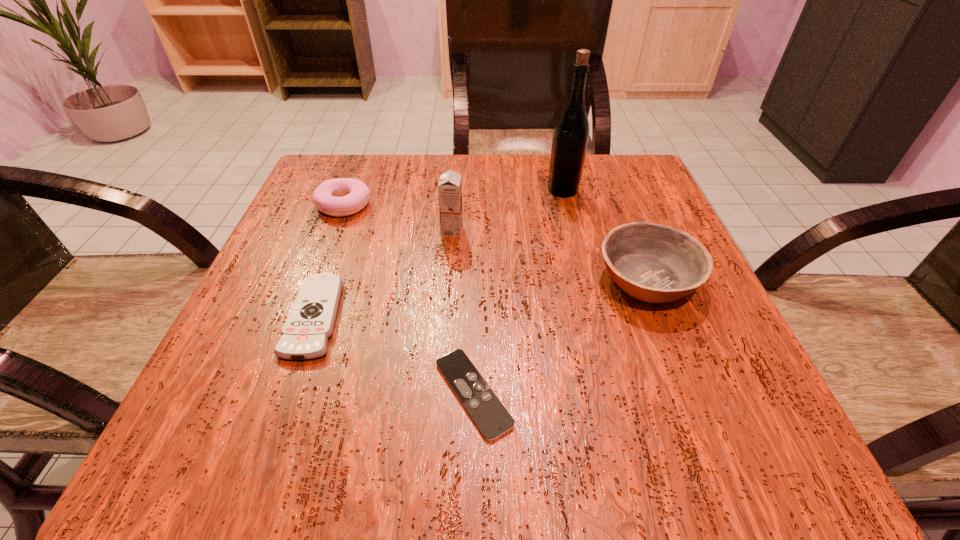
Image resolution: width=960 pixels, height=540 pixels. Find the location of `the tallest object`. the tallest object is located at coordinates (570, 139).

Image resolution: width=960 pixels, height=540 pixels. I want to click on chocolate milk, so click(x=450, y=184).

Where is `the fourth nearest object`? The width and height of the screenshot is (960, 540). the fourth nearest object is located at coordinates (450, 184).

Image resolution: width=960 pixels, height=540 pixels. What are the coordinates of `the third tallest object` in the screenshot? It's located at (653, 263).

Locate an element on the screen. the fourth tallest object is located at coordinates (342, 196).

Where is `the fifth tallest object`? The width and height of the screenshot is (960, 540). the fifth tallest object is located at coordinates (310, 323).

I want to click on the taller remote control, so click(310, 323).

This screenshot has width=960, height=540. Identify the location of the shortest object. (491, 417).

Locate an element on the screen. The width and height of the screenshot is (960, 540). the right remote control is located at coordinates (491, 417).

Image resolution: width=960 pixels, height=540 pixels. I want to click on vacant space located 0.110m on the left of the tallest object, so click(x=497, y=190).